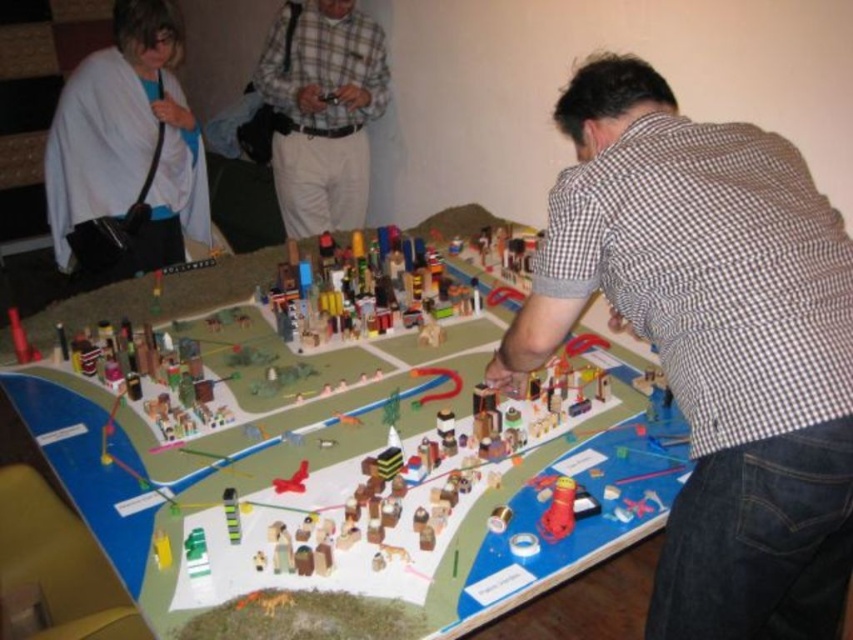
You are observing the model city from above. Which object is closer to you between the brown checkered shirt at center and the white fabric at upper left?

The brown checkered shirt at center is closer to the viewer than the white fabric at upper left.

You are organizing a model city and notice two shirts on the table. The shirts are the brown checkered shirt at center and the plaid fabric shirt at center. Which shirt is wider?

The brown checkered shirt at center is wider than the plaid fabric shirt at center.

You are standing at the edge of the table where the city model is displayed. You notice a point marked at coordinates (712, 342). What object or feature is located at that specific coordinate on the city model?

The point at coordinates (712, 342) indicates the location of the brown checkered shirt at center.